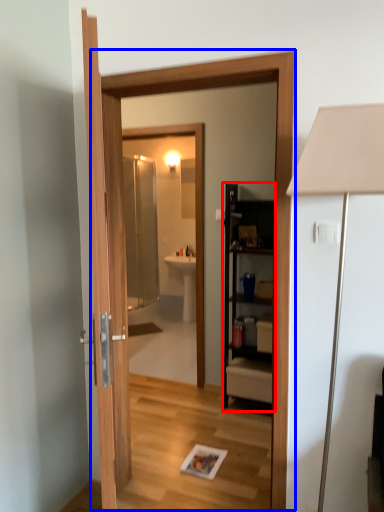
Question: Which of the following is the closest to the observer, cabinetry (highlighted by a red box) or screen door (highlighted by a blue box)?

Choices:
 (A) cabinetry
 (B) screen door

Answer: (B)